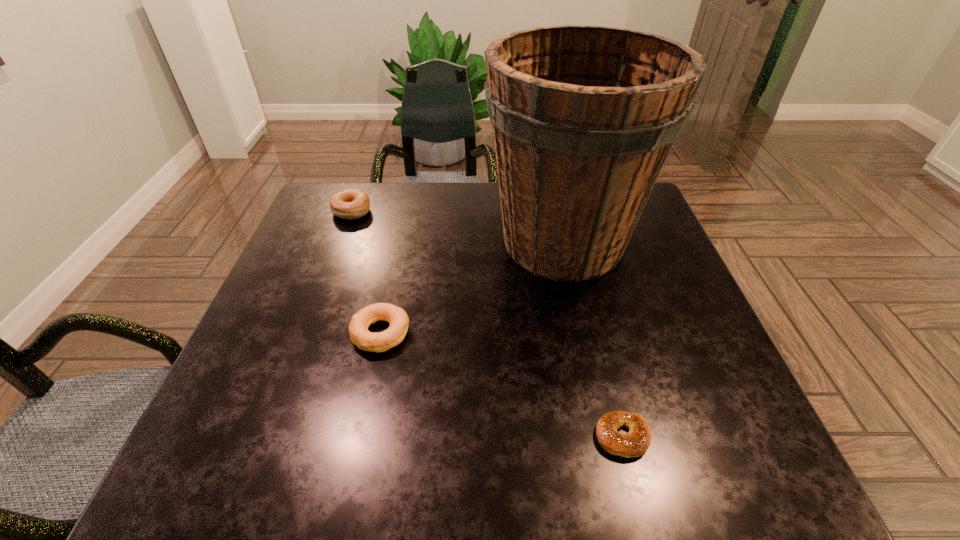
I want to click on vacant space located on the back of the nearest bagel, so click(x=582, y=275).

Identify the location of bucket at the far edge. tap(583, 117).

The image size is (960, 540). What are the coordinates of `bagel located at the far edge` in the screenshot? It's located at (350, 203).

Identify the location of object that is at the near edge. (633, 444).

Image resolution: width=960 pixels, height=540 pixels. I want to click on object present at the left edge, so click(350, 203).

Where is `object situated at the right edge`? The image size is (960, 540). object situated at the right edge is located at coordinates (583, 117).

At what (x,y) coordinates should I click in order to perform the action: click on object present at the far left corner. Please return your answer as a coordinate pair (x, y). Looking at the image, I should click on (350, 203).

Where is `object located in the far right corner section of the desktop`? The image size is (960, 540). object located in the far right corner section of the desktop is located at coordinates (583, 117).

Identify the location of vacant area at the far edge of the desktop. (408, 185).

Locate an element on the screen. The image size is (960, 540). free space at the near edge of the desktop is located at coordinates (297, 438).